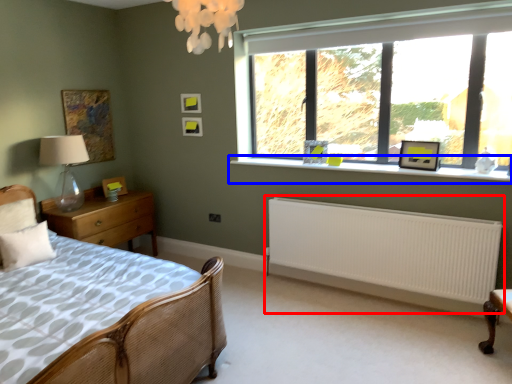
Question: Which object is further to the camera taking this photo, radiator (highlighted by a red box) or window sill (highlighted by a blue box)?

Choices:
 (A) radiator
 (B) window sill

Answer: (B)